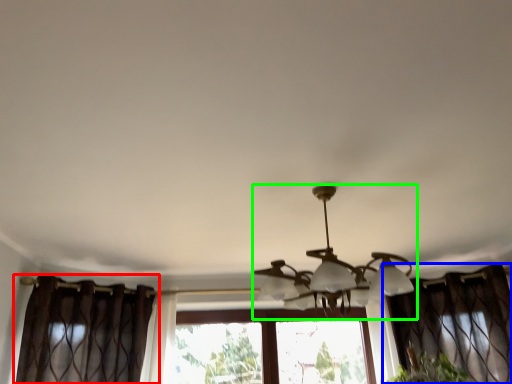
Question: Considering the real-world distances, which object is closest to curtain (highlighted by a red box)? curtain (highlighted by a blue box) or lamp (highlighted by a green box).

Choices:
 (A) curtain
 (B) lamp

Answer: (B)